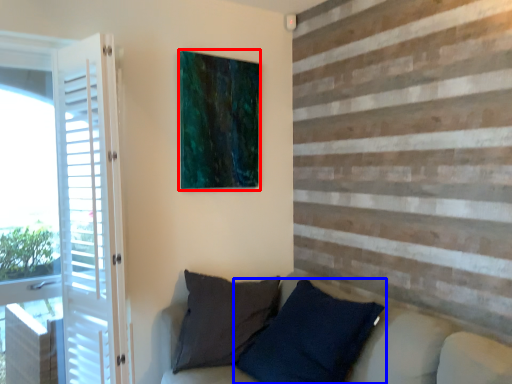
Question: Among these objects, which one is farthest to the camera, picture frame (highlighted by a red box) or pillow (highlighted by a blue box)?

Choices:
 (A) picture frame
 (B) pillow

Answer: (A)